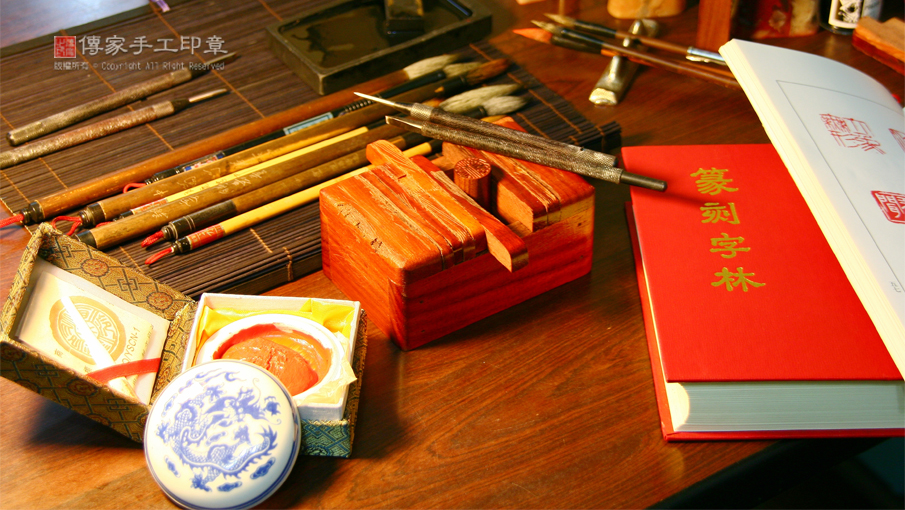
I want to click on white and blue portable vanity, so click(281, 427).